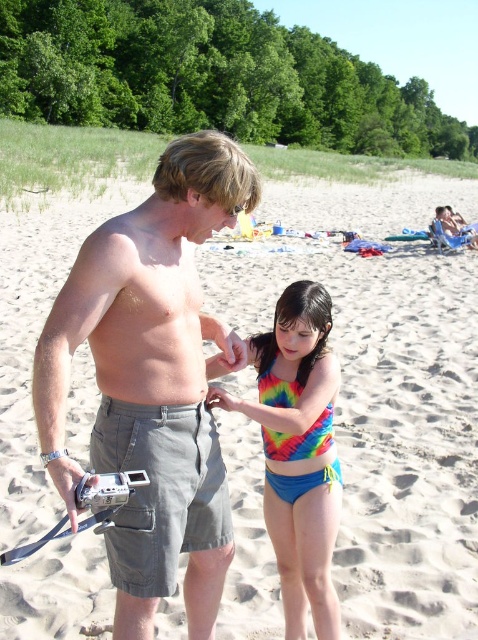
In the scene shown: You are standing at the point marked as point (387, 420). What is the terrain like at your current location?

The terrain at point (387, 420) is sandy beach at center.